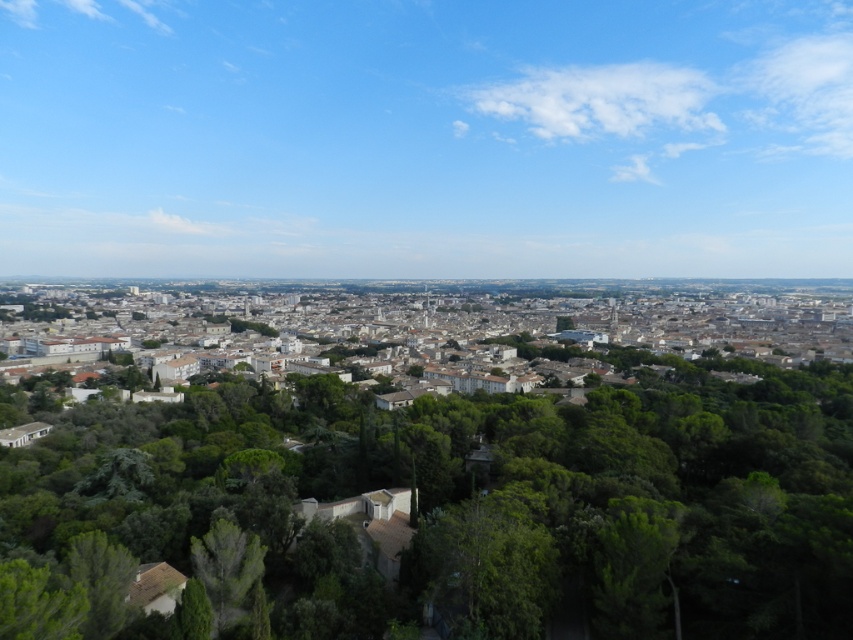
You are standing at the point marked as point (456,506) in the image. What object is directly in front of you?

The green leafy tree at center is located at point (456,506), so the object directly in front of you is the green leafy tree at center.

You are a city planner analyzing the urban layout. Given the green leafy tree at center and the white concrete buildings at center, which one takes up more area in the central part of the image?

The white concrete buildings at center occupy more space than the green leafy tree at center in the central part of the image.

You are a drone operator tasked with capturing aerial footage of the urban landscape. Your drone has a maximum flight range of 250 meters. Starting from the white concrete buildings at center, can you safely fly your drone to the green leafy tree at lower left without exceeding its range?

The distance between the white concrete buildings at center and the green leafy tree at lower left is 250.99 meters, which exceeds the drone operator maximum flight range of 250 meters. Therefore, the drone cannot safely reach the green leafy tree at lower left without exceeding its range.